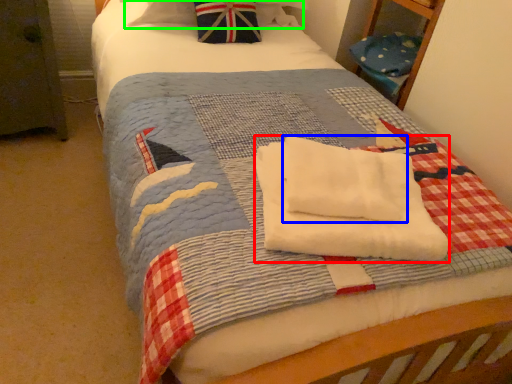
Question: Which is farther away from beach towel (highlighted by a red box)? beach towel (highlighted by a blue box) or pillow (highlighted by a green box)?

Choices:
 (A) beach towel
 (B) pillow

Answer: (B)